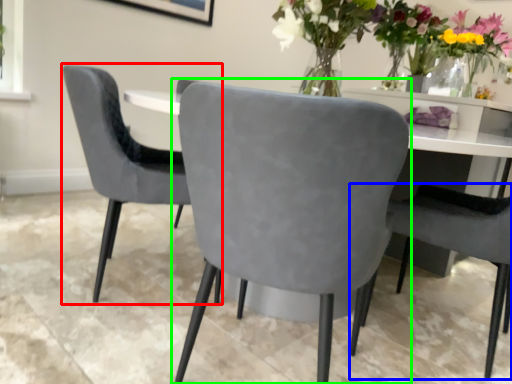
Question: Which object is the closest to the chair (highlighted by a red box)? Choose among these: chair (highlighted by a blue box) or chair (highlighted by a green box).

Choices:
 (A) chair
 (B) chair

Answer: (B)